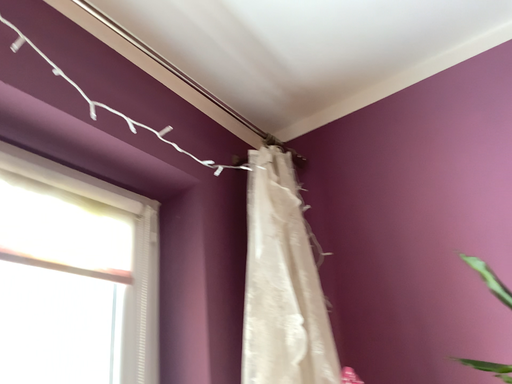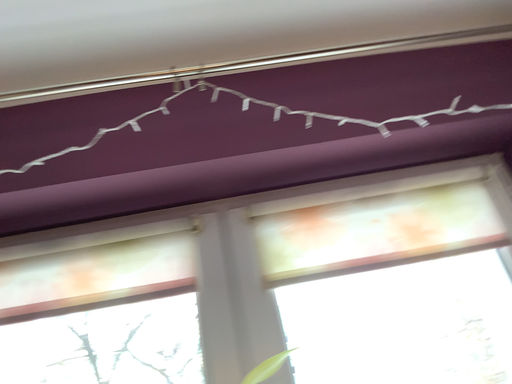
Question: How did the camera likely rotate when shooting the video?

Choices:
 (A) rotated right
 (B) rotated left

Answer: (B)